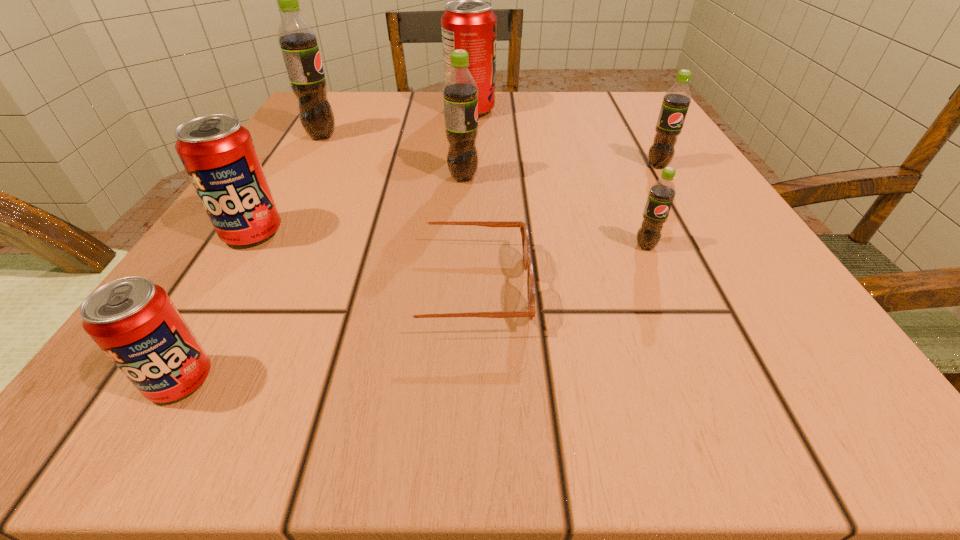
This screenshot has width=960, height=540. I want to click on the biggest green soda, so click(299, 44).

Image resolution: width=960 pixels, height=540 pixels. I want to click on the farthest green soda, so click(x=299, y=44).

Find the location of a particular element. This screenshot has height=540, width=960. the biggest red soda can is located at coordinates (470, 24).

Where is `the rightmost red soda can`? the rightmost red soda can is located at coordinates (470, 24).

This screenshot has height=540, width=960. In order to click on the third smallest green soda in this screenshot , I will do `click(460, 91)`.

This screenshot has width=960, height=540. I want to click on the second smallest green soda, so click(675, 103).

Locate an element on the screen. This screenshot has width=960, height=540. the rightmost soda can is located at coordinates (675, 103).

I want to click on the second nearest red soda can, so click(217, 152).

You are a GUI agent. You are given a task and a screenshot of the screen. Output one action in this format:
    pyautogui.click(x=<x>, y=<y>)
    Task: Click on the nearest green soda
    Image resolution: width=960 pixels, height=540 pixels.
    Given the screenshot: What is the action you would take?
    pyautogui.click(x=662, y=193)

Locate an element on the screen. The width and height of the screenshot is (960, 540). the third green soda from left to right is located at coordinates (662, 193).